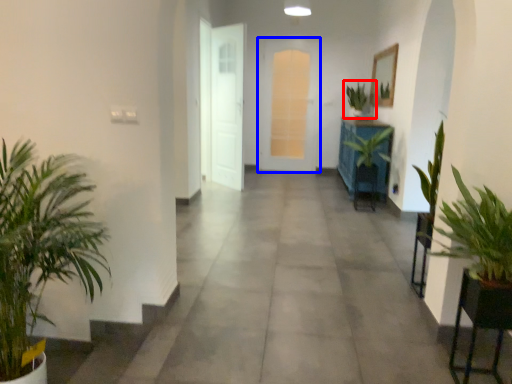
Question: Which object is further to the camera taking this photo, houseplant (highlighted by a red box) or door (highlighted by a blue box)?

Choices:
 (A) houseplant
 (B) door

Answer: (B)